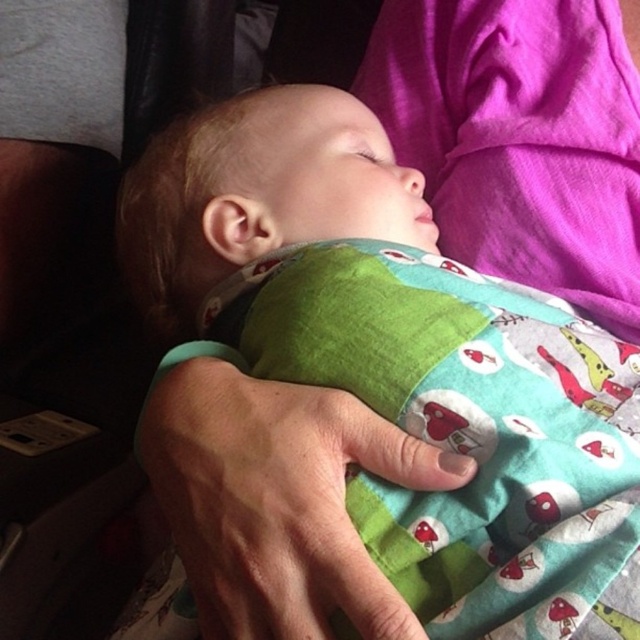
Question: Among these points, which one is farthest from the camera?

Choices:
 (A) [170, 262]
 (B) [344, 564]

Answer: (A)

Question: Is soft cotton baby at center closer to the viewer compared to green fabric at center?

Choices:
 (A) yes
 (B) no

Answer: (A)

Question: Is the position of soft cotton baby at center more distant than that of green fabric at center?

Choices:
 (A) no
 (B) yes

Answer: (A)

Question: Does soft cotton baby at center have a greater width compared to green fabric at center?

Choices:
 (A) yes
 (B) no

Answer: (A)